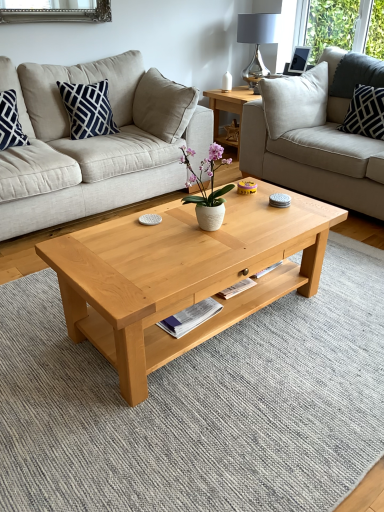
Locate an element on the screen. blank space situated above natural wood coffee table at center (from a real-world perspective) is located at coordinates (197, 229).